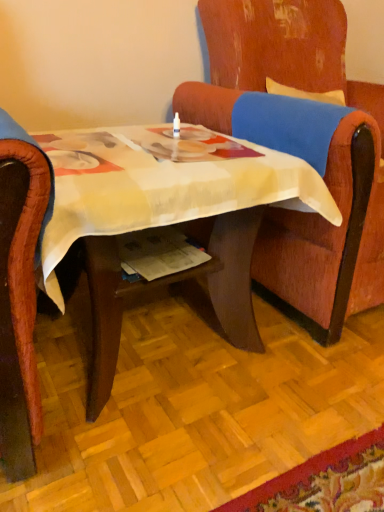
Image resolution: width=384 pixels, height=512 pixels. What do you see at coordinates (169, 216) in the screenshot? I see `wooden desk at center` at bounding box center [169, 216].

Locate an element on the screen. The width and height of the screenshot is (384, 512). wooden desk at center is located at coordinates (169, 216).

The height and width of the screenshot is (512, 384). What do you see at coordinates (327, 157) in the screenshot?
I see `wooden chair at center` at bounding box center [327, 157].

The image size is (384, 512). What are the coordinates of `wooden chair at center` in the screenshot? It's located at (327, 157).

The height and width of the screenshot is (512, 384). I want to click on wooden desk at center, so click(169, 216).

In the image, is wooden desk at center on the left side or the right side of wooden chair at center?

Based on their positions, wooden desk at center is located to the left of wooden chair at center.

Considering the relative positions of wooden desk at center and wooden chair at center in the image provided, is wooden desk at center behind wooden chair at center?

No, the depth of wooden desk at center is less than that of wooden chair at center.

Between point (170, 170) and point (233, 23), which one is positioned in front?

Point (170, 170)

From the image's perspective, which object appears higher, wooden desk at center or wooden chair at center?

wooden chair at center, from the image's perspective.

From a real-world perspective, who is located higher, wooden desk at center or wooden chair at center?

From a 3D spatial view, wooden chair at center is above.

Between wooden desk at center and wooden chair at center, which one has larger width?

Wider between the two is wooden chair at center.

Consider the image. Can you confirm if wooden desk at center is shorter than wooden chair at center?

Yes, wooden desk at center is shorter than wooden chair at center.

From the picture: Who is smaller, wooden desk at center or wooden chair at center?

With smaller size is wooden desk at center.

Is wooden chair at center surrounded by wooden desk at center?

No, wooden chair at center is not inside wooden desk at center.

Would you consider wooden desk at center to be distant from wooden chair at center?

wooden desk at center is actually quite close to wooden chair at center.

Is wooden desk at center turned away from wooden chair at center?

No.

Locate an element on the screen. The image size is (384, 512). desk that is below the wooden chair at center (from the image's perspective) is located at coordinates (169, 216).

Which object is positioned more to the left, wooden chair at center or wooden desk at center?

wooden desk at center.

Does wooden chair at center lie behind wooden desk at center?

Yes, wooden chair at center is further from the camera.

Which is in front, point (344, 133) or point (263, 162)?

The point (344, 133) is more forward.

From the image's perspective, which is below, wooden chair at center or wooden desk at center?

wooden desk at center is shown below in the image.

From a real-world perspective, who is located lower, wooden chair at center or wooden desk at center?

In real-world perspective, wooden desk at center is lower.

Can you confirm if wooden chair at center is thinner than wooden desk at center?

Incorrect, the width of wooden chair at center is not less than that of wooden desk at center.

Considering the sizes of objects wooden chair at center and wooden desk at center in the image provided, who is shorter, wooden chair at center or wooden desk at center?

Standing shorter between the two is wooden desk at center.

Does wooden chair at center have a larger size compared to wooden desk at center?

Correct, wooden chair at center is larger in size than wooden desk at center.

Based on the photo, would you say wooden chair at center is outside wooden desk at center?

That's correct, wooden chair at center is outside of wooden desk at center.

Is the surface of wooden chair at center in direct contact with wooden desk at center?

No, wooden chair at center is not beside wooden desk at center.

Is wooden chair at center aimed at wooden desk at center?

No.

How different are the orientations of wooden chair at center and wooden desk at center in degrees?

The angular difference between wooden chair at center and wooden desk at center is 8.56e-05 degrees.

The height and width of the screenshot is (512, 384). I want to click on chair behind the wooden desk at center, so click(327, 157).

This screenshot has height=512, width=384. Find the location of `desk below the wooden chair at center (from the image's perspective)`. desk below the wooden chair at center (from the image's perspective) is located at coordinates [169, 216].

This screenshot has width=384, height=512. Find the location of `desk located underneath the wooden chair at center (from a real-world perspective)`. desk located underneath the wooden chair at center (from a real-world perspective) is located at coordinates (169, 216).